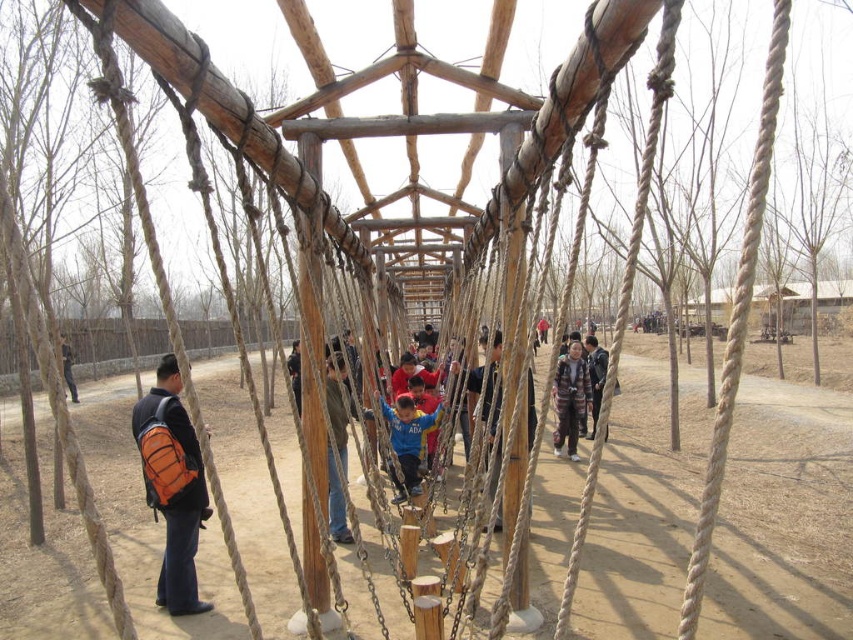
You are a photographer trying to capture a clear shot of both the striped fabric jacket at center and the camouflage jacket at center. Since you want to ensure both are visible, which jacket might you need to adjust your focus for more carefully?

The striped fabric jacket at center is thinner than the camouflage jacket at center, so you might need to adjust focus more carefully for the striped fabric jacket at center to ensure it appears clear in the photo.